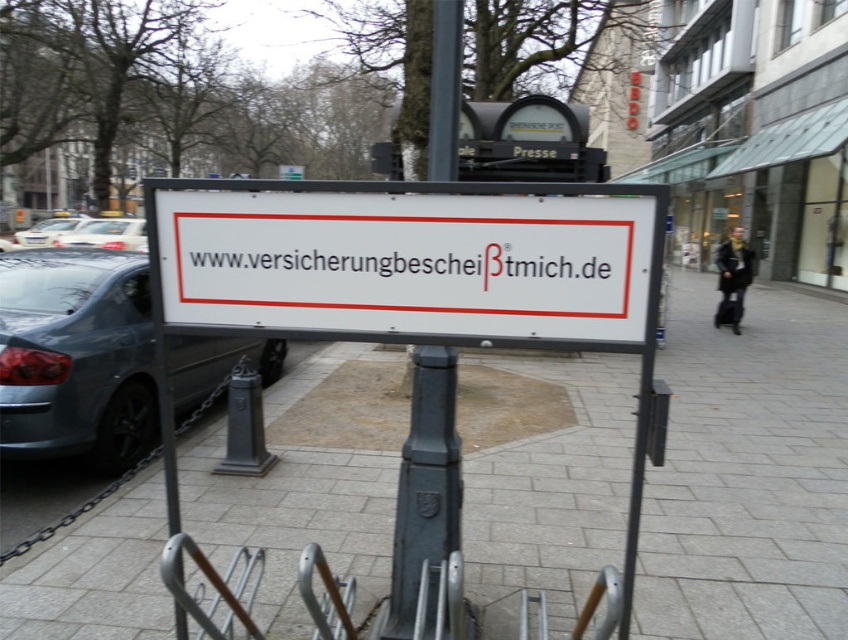
Is white concrete pavement at center bigger than white glossy car at left?

No, white concrete pavement at center is not bigger than white glossy car at left.

Describe the element at coordinates (749, 474) in the screenshot. Image resolution: width=848 pixels, height=640 pixels. I see `white concrete pavement at center` at that location.

Image resolution: width=848 pixels, height=640 pixels. I want to click on white concrete pavement at center, so (749, 474).

Does white concrete pavement at center appear on the right side of dark gray metal pole at center?

Yes, white concrete pavement at center is to the right of dark gray metal pole at center.

Can you confirm if white concrete pavement at center is positioned below dark gray metal pole at center?

Correct, white concrete pavement at center is located below dark gray metal pole at center.

The image size is (848, 640). What do you see at coordinates (749, 474) in the screenshot?
I see `white concrete pavement at center` at bounding box center [749, 474].

At what (x,y) coordinates should I click in order to perform the action: click on white concrete pavement at center. Please return your answer as a coordinate pair (x, y). This screenshot has height=640, width=848. Looking at the image, I should click on (749, 474).

Measure the distance between point [394,339] and camera.

Point [394,339] is 7.12 feet away from camera.

Which is behind, point (294, 257) or point (26, 234)?

The point (26, 234) is more distant.

Locate an element on the screen. The width and height of the screenshot is (848, 640). white plastic sign at center is located at coordinates coord(411,260).

You are a GUI agent. You are given a task and a screenshot of the screen. Output one action in this format:
    pyautogui.click(x=<x>, y=<y>)
    Task: Click on the white plastic sign at center
    The height and width of the screenshot is (640, 848).
    Given the screenshot: What is the action you would take?
    pyautogui.click(x=411, y=260)